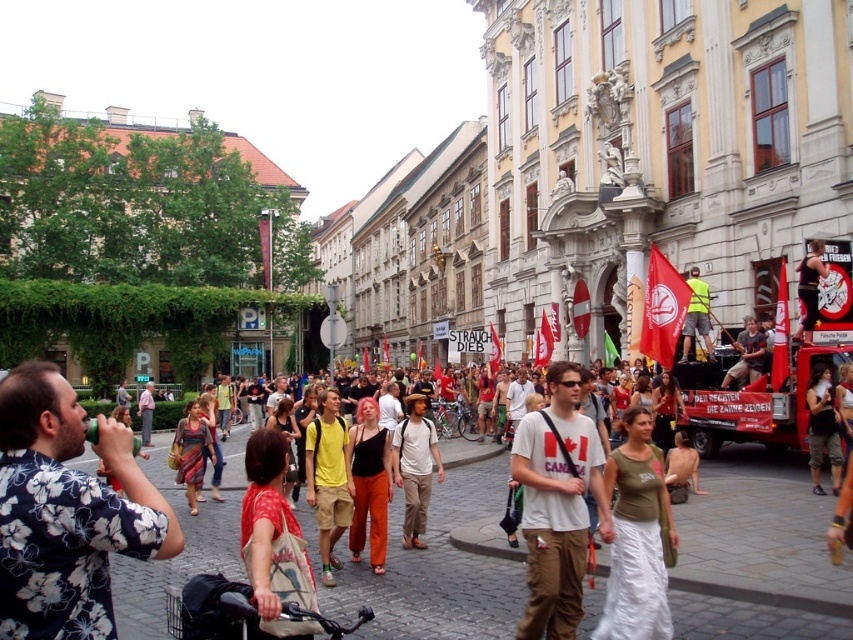
Question: Can you confirm if matte black tank top at center is positioned to the right of multicolored woven dress at center?

Choices:
 (A) no
 (B) yes

Answer: (B)

Question: Which point is farther from the camera taking this photo?

Choices:
 (A) (323, 408)
 (B) (428, 492)
 (C) (830, 438)
 (D) (263, 595)

Answer: (A)

Question: Can you confirm if printed fabric bag at center is smaller than yellow cotton shirt at center?

Choices:
 (A) no
 (B) yes

Answer: (A)

Question: Which point is closer to the camera?

Choices:
 (A) (195, 460)
 (B) (288, 522)
 (C) (321, 577)
 (D) (639, 476)

Answer: (B)

Question: Can you confirm if printed fabric bag at center is thinner than yellow cotton shirt at center?

Choices:
 (A) yes
 (B) no

Answer: (B)

Question: Among these objects, which one is nearest to the camera?

Choices:
 (A) yellow cotton shirt at center
 (B) multicolored woven dress at center
 (C) white cotton shirt at center

Answer: (A)